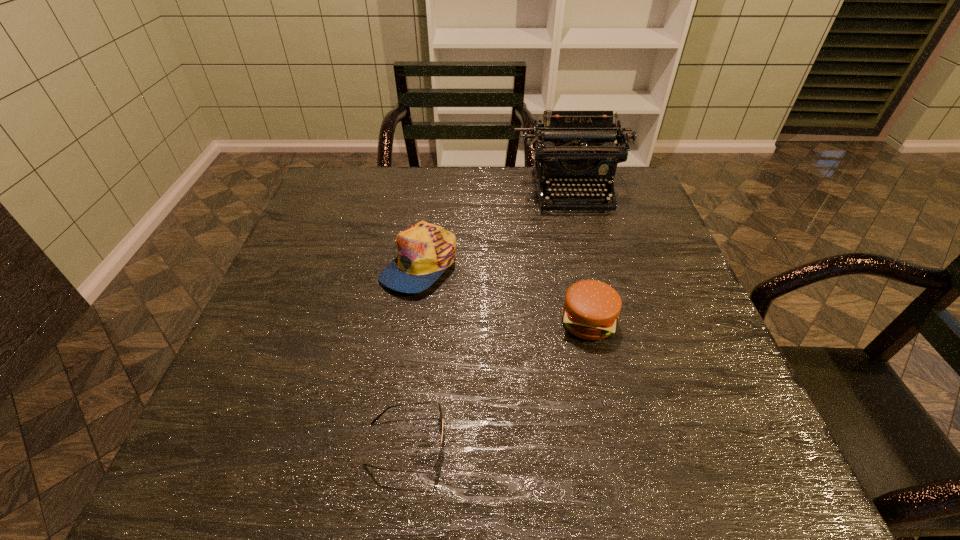
The height and width of the screenshot is (540, 960). In the image, there is a desktop. Find the location of `free space at the far left corner`. free space at the far left corner is located at coordinates (339, 192).

You are a GUI agent. You are given a task and a screenshot of the screen. Output one action in this format:
    pyautogui.click(x=<x>, y=<y>)
    Task: Click on the free space between the third farthest object and the cap
    Image resolution: width=960 pixels, height=540 pixels.
    Given the screenshot: What is the action you would take?
    pyautogui.click(x=503, y=293)

I want to click on unoccupied position between the sunglasses and the second farthest object, so click(413, 354).

Identify the location of empty space that is in between the sunglasses and the third shortest object. [x=413, y=354].

Find the location of a particular element. Image resolution: width=960 pixels, height=540 pixels. free space between the cap and the second nearest object is located at coordinates [x=503, y=293].

You are a GUI agent. You are given a task and a screenshot of the screen. Output one action in this format:
    pyautogui.click(x=<x>, y=<y>)
    Task: Click on the vacant space in between the hamburger and the farthest object
    This screenshot has width=960, height=540.
    Given the screenshot: What is the action you would take?
    pyautogui.click(x=580, y=256)

The width and height of the screenshot is (960, 540). I want to click on vacant space that is in between the second tallest object and the typewriter, so click(x=495, y=227).

This screenshot has width=960, height=540. Find the location of `vacant space that's between the second nearest object and the shortest object`. vacant space that's between the second nearest object and the shortest object is located at coordinates (497, 383).

Where is `free space between the shortest object and the second farthest object`? This screenshot has width=960, height=540. free space between the shortest object and the second farthest object is located at coordinates (413, 354).

I want to click on vacant area that lies between the cap and the tallest object, so click(x=495, y=227).